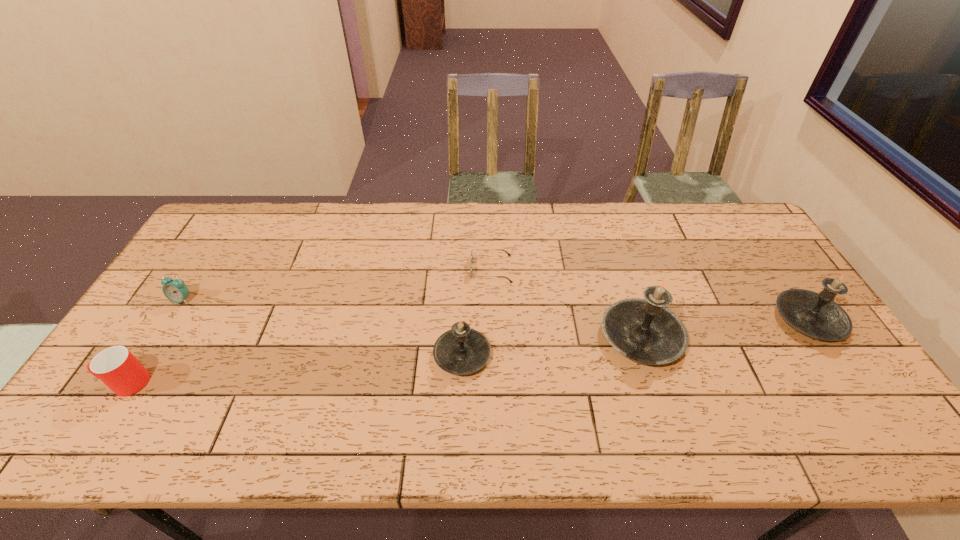
Where is `the leftmost candle`? The height and width of the screenshot is (540, 960). the leftmost candle is located at coordinates (460, 351).

Find the location of a particular element. The height and width of the screenshot is (540, 960). the fourth shortest object is located at coordinates (460, 351).

Locate an element on the screen. Image resolution: width=960 pixels, height=540 pixels. the second object from right to left is located at coordinates (644, 330).

You are a GUI agent. You are given a task and a screenshot of the screen. Output one action in this format:
    pyautogui.click(x=<x>, y=<y>)
    Task: Click on the second candle from right to left
    Image resolution: width=960 pixels, height=540 pixels.
    Given the screenshot: What is the action you would take?
    pyautogui.click(x=644, y=330)

The width and height of the screenshot is (960, 540). What are the coordinates of `the second shortest candle` in the screenshot? It's located at (815, 314).

Where is `the rightmost object`? This screenshot has height=540, width=960. the rightmost object is located at coordinates (815, 314).

The image size is (960, 540). I want to click on the farthest object, so click(x=510, y=281).

Locate an element on the screen. This screenshot has height=540, width=960. the shortest object is located at coordinates (510, 281).

Where is `alarm clock`? Image resolution: width=960 pixels, height=540 pixels. alarm clock is located at coordinates (175, 290).

Image resolution: width=960 pixels, height=540 pixels. I want to click on cup, so click(116, 367).